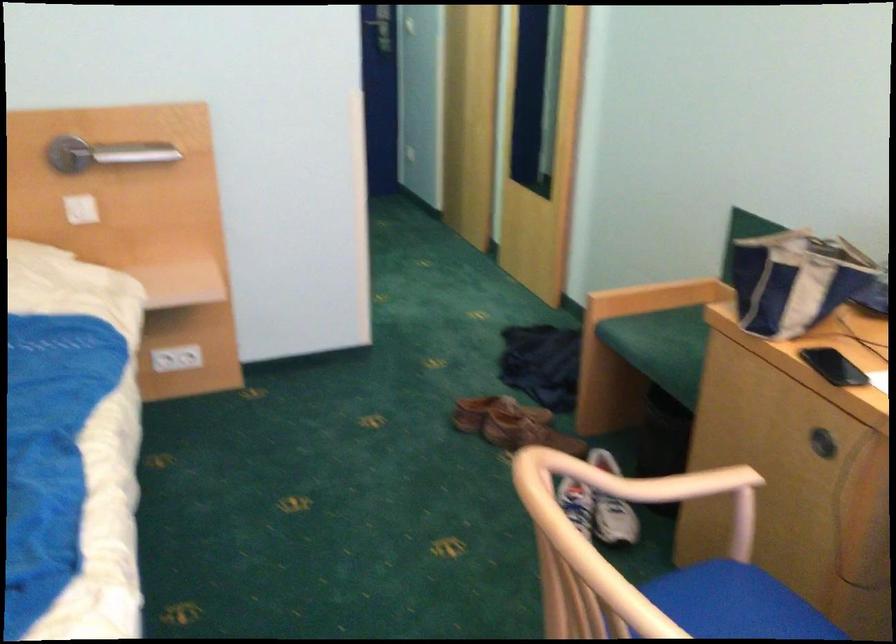
Locate an element on the screen. Image resolution: width=896 pixels, height=644 pixels. blue chair sitting surface is located at coordinates point(711,590).